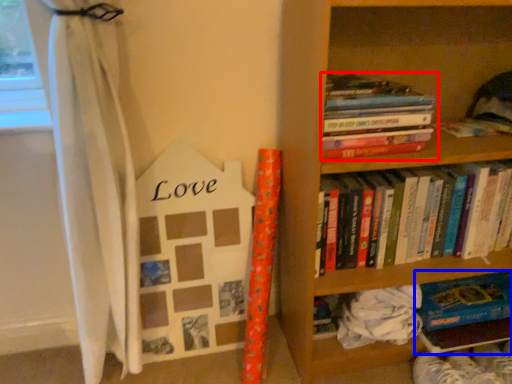
Question: Which point is further to the camera, book (highlighted by a red box) or book (highlighted by a blue box)?

Choices:
 (A) book
 (B) book

Answer: (B)